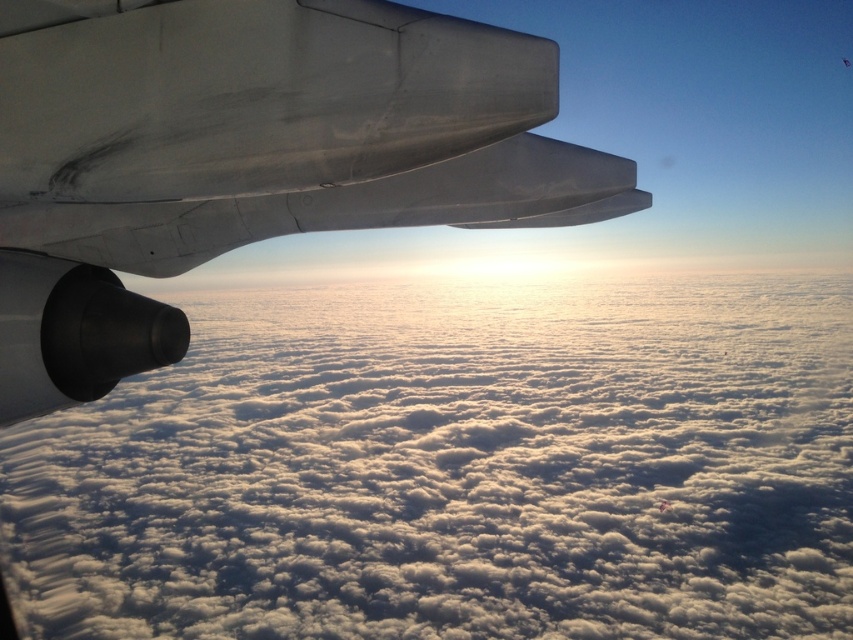
Can you confirm if white fluffy cloud at upper left is positioned above metallic gray wing at upper left?

No.

Which is in front, point (306, 529) or point (489, 33)?

Positioned in front is point (489, 33).

Does point (209, 477) lie behind point (283, 51)?

Yes, point (209, 477) is farther from viewer.

Locate an element on the screen. This screenshot has width=853, height=640. white fluffy cloud at upper left is located at coordinates (445, 484).